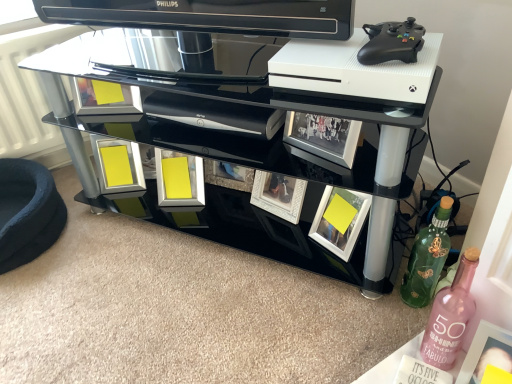
The width and height of the screenshot is (512, 384). I want to click on free space that is in between pink glass bottle at lower right, the 1th bottle when ordered from front to back, and velvet cushion at lower left, so click(x=184, y=275).